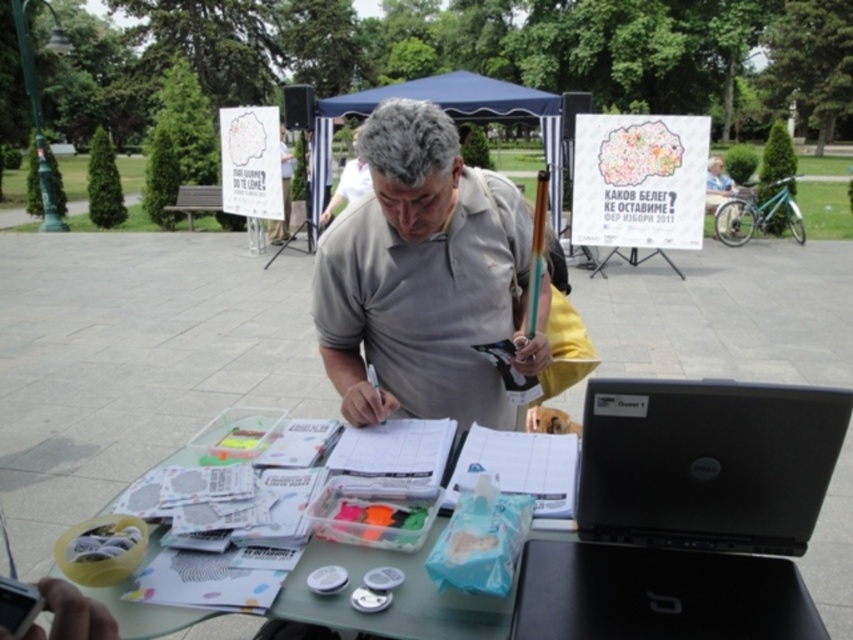
You are a photographer wanting to capture the man and his workspace. You notice the black plastic laptop at center and the clear plastic table at center. Which object should you position your camera to the left of to ensure both are in frame?

You should position your camera to the left of the clear plastic table at center. Since the black plastic laptop at center is to the right of the clear plastic table at center, placing the camera left of the table ensures both objects are included in the frame.

You are a photographer trying to capture the man in the gray matte shirt at center without including the clear plastic table at center in the frame. Based on their positions, is this possible?

The clear plastic table at center is behind the gray matte shirt at center, so the photographer can position themselves to focus on the man while framing the shot so the table is out of view behind him.